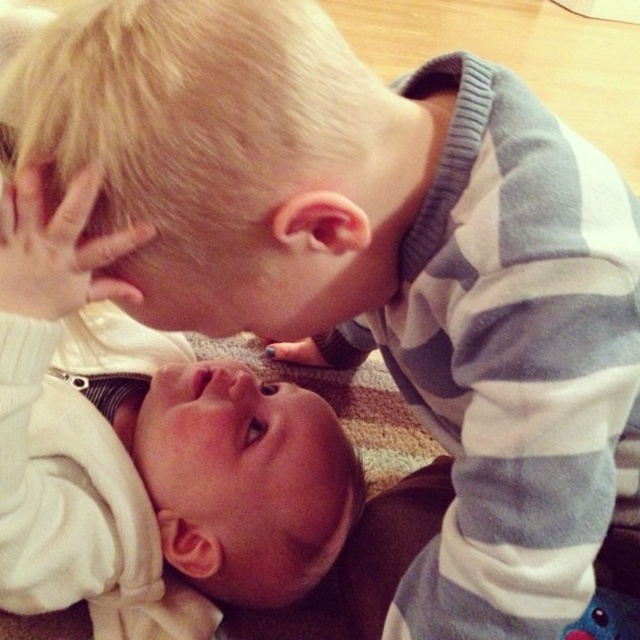
Question: Can you confirm if white soft baby at center is positioned below blonde hair at upper center?

Choices:
 (A) yes
 (B) no

Answer: (A)

Question: Does white soft baby at center have a greater width compared to blonde hair at upper center?

Choices:
 (A) no
 (B) yes

Answer: (B)

Question: Does white soft baby at center come in front of blonde hair at upper center?

Choices:
 (A) no
 (B) yes

Answer: (A)